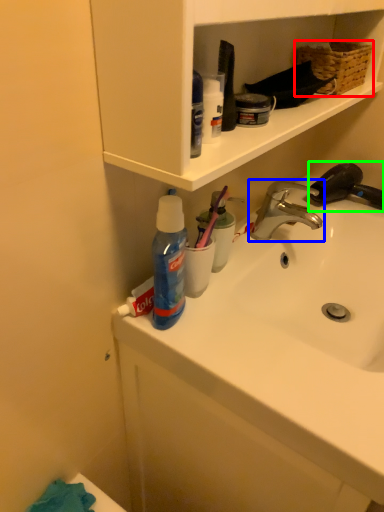
Question: Estimate the real-world distances between objects in this image. Which object is closer to basket (highlighted by a red box), tap (highlighted by a blue box) or faucet (highlighted by a green box)?

Choices:
 (A) tap
 (B) faucet

Answer: (B)